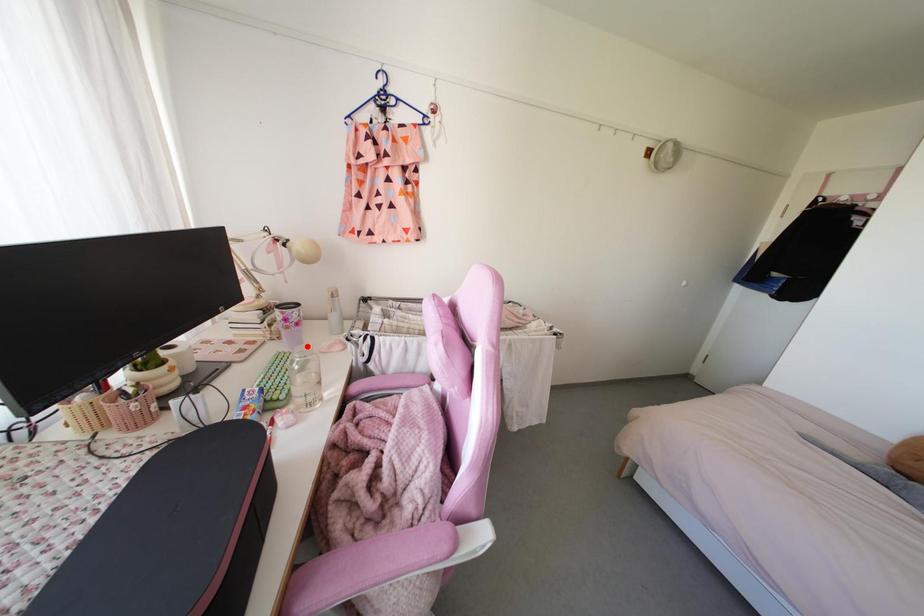
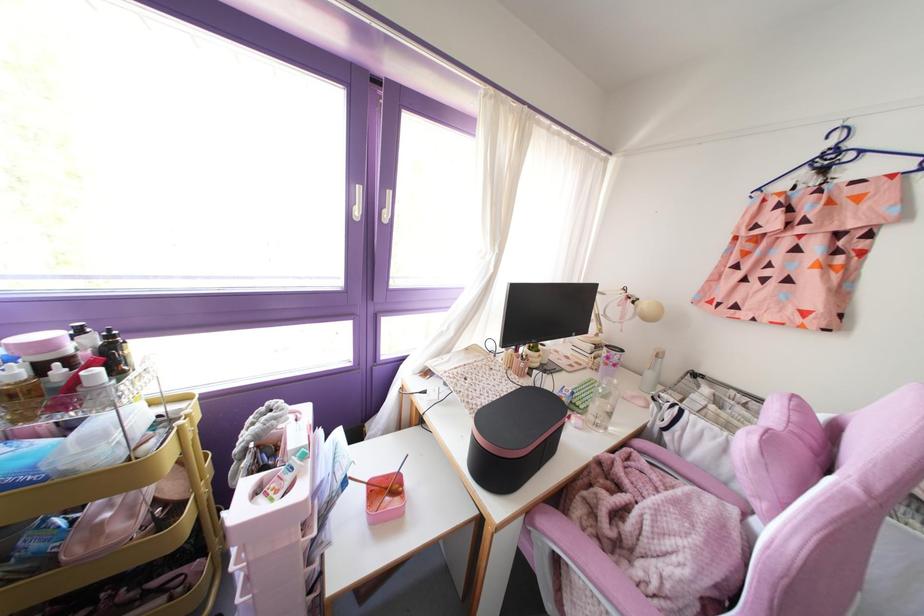
Locate, in the second image, the point that corresponds to the highlighted location in the first image.

(614, 381)